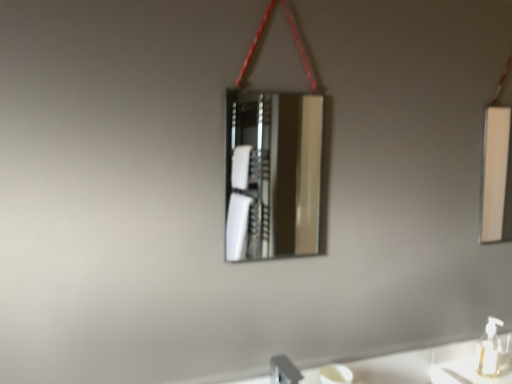
Question: Can you confirm if silver metallic faucet at lower center is thinner than white glossy mirror at right, the 1th mirror when ordered from back to front?

Choices:
 (A) no
 (B) yes

Answer: (A)

Question: From the image's perspective, is silver metallic faucet at lower center above white glossy mirror at right, the 1th mirror when ordered from back to front?

Choices:
 (A) no
 (B) yes

Answer: (A)

Question: Can white glossy mirror at right, placed as the 2th mirror when sorted from front to back, be found inside silver metallic faucet at lower center?

Choices:
 (A) yes
 (B) no

Answer: (B)

Question: From a real-world perspective, is silver metallic faucet at lower center physically above white glossy mirror at right, arranged as the 2th mirror when viewed from the left?

Choices:
 (A) no
 (B) yes

Answer: (A)

Question: Considering the relative positions of silver metallic faucet at lower center and white glossy mirror at right, the 1th mirror when ordered from back to front, in the image provided, is silver metallic faucet at lower center to the left of white glossy mirror at right, the 1th mirror when ordered from back to front, from the viewer's perspective?

Choices:
 (A) no
 (B) yes

Answer: (B)

Question: Is white plastic soap dispenser at lower right inside the boundaries of white glossy mirror at right, arranged as the 2th mirror when viewed from the left, or outside?

Choices:
 (A) inside
 (B) outside

Answer: (B)

Question: From the image's perspective, is white plastic soap dispenser at lower right positioned above or below white glossy mirror at right, placed as the first mirror when sorted from right to left?

Choices:
 (A) above
 (B) below

Answer: (B)

Question: In terms of width, does white plastic soap dispenser at lower right look wider or thinner when compared to white glossy mirror at right, placed as the 2th mirror when sorted from front to back?

Choices:
 (A) wide
 (B) thin

Answer: (A)

Question: From a real-world perspective, is white plastic soap dispenser at lower right positioned above or below white glossy mirror at right, placed as the 2th mirror when sorted from front to back?

Choices:
 (A) below
 (B) above

Answer: (A)

Question: Looking at the image, does white plastic soap dispenser at lower right seem bigger or smaller compared to silver metallic faucet at lower center?

Choices:
 (A) small
 (B) big

Answer: (B)

Question: From the image's perspective, is white plastic soap dispenser at lower right located above or below silver metallic faucet at lower center?

Choices:
 (A) below
 (B) above

Answer: (B)

Question: From a real-world perspective, is white plastic soap dispenser at lower right positioned above or below silver metallic faucet at lower center?

Choices:
 (A) below
 (B) above

Answer: (B)

Question: Based on their positions, is white plastic soap dispenser at lower right located to the left or right of silver metallic faucet at lower center?

Choices:
 (A) right
 (B) left

Answer: (A)

Question: Is point (499, 190) positioned closer to the camera than point (281, 367)?

Choices:
 (A) closer
 (B) farther

Answer: (B)

Question: Which is correct: white glossy mirror at right, placed as the 2th mirror when sorted from front to back, is inside silver metallic faucet at lower center, or outside of it?

Choices:
 (A) outside
 (B) inside

Answer: (A)